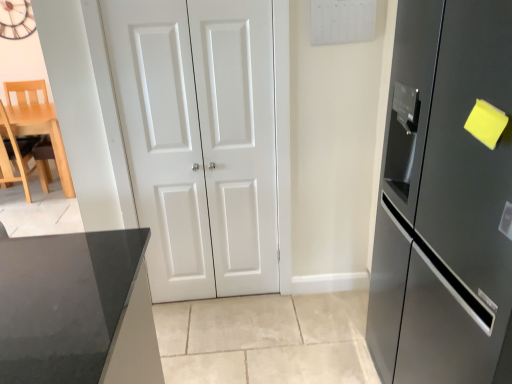
Question: Considering the relative sizes of light wood chair at left and white matte door at center, positioned as the 1th door in left-to-right order, in the image provided, is light wood chair at left wider than white matte door at center, positioned as the 1th door in left-to-right order,?

Choices:
 (A) yes
 (B) no

Answer: (A)

Question: Does light wood chair at left come behind white matte door at center, positioned as the 1th door in left-to-right order?

Choices:
 (A) yes
 (B) no

Answer: (A)

Question: Is light wood chair at left facing away from white matte door at center, placed as the second door when sorted from right to left?

Choices:
 (A) yes
 (B) no

Answer: (B)

Question: Is light wood chair at left positioned before white matte door at center, positioned as the 1th door in left-to-right order?

Choices:
 (A) no
 (B) yes

Answer: (A)

Question: From a real-world perspective, does light wood chair at left sit lower than white matte door at center, placed as the second door when sorted from right to left?

Choices:
 (A) no
 (B) yes

Answer: (B)

Question: From their relative heights in the image, would you say wooden clock at upper left is taller or shorter than light wood chair at left?

Choices:
 (A) short
 (B) tall

Answer: (A)

Question: Is wooden clock at upper left to the left or to the right of light wood chair at left in the image?

Choices:
 (A) left
 (B) right

Answer: (A)

Question: Looking at their shapes, would you say wooden clock at upper left is wider or thinner than light wood chair at left?

Choices:
 (A) wide
 (B) thin

Answer: (B)

Question: Considering the positions of point (11, 8) and point (3, 177), is point (11, 8) closer or farther from the camera than point (3, 177)?

Choices:
 (A) farther
 (B) closer

Answer: (B)

Question: Considering their positions, is white matte door at center, positioned as the first door in right-to-left order, located in front of or behind wooden clock at upper left?

Choices:
 (A) behind
 (B) front

Answer: (B)

Question: In the image, is white matte door at center, positioned as the first door in right-to-left order, on the left side or the right side of wooden clock at upper left?

Choices:
 (A) right
 (B) left

Answer: (A)

Question: From the image's perspective, is white matte door at center, which is the 2th door in left-to-right order, above or below wooden clock at upper left?

Choices:
 (A) below
 (B) above

Answer: (A)

Question: From a real-world perspective, is white matte door at center, positioned as the first door in right-to-left order, positioned above or below wooden clock at upper left?

Choices:
 (A) above
 (B) below

Answer: (B)

Question: From the image's perspective, is light wood chair at left located above or below white matte door at center, which is the 2th door in left-to-right order?

Choices:
 (A) above
 (B) below

Answer: (A)

Question: Considering the positions of light wood chair at left and white matte door at center, which is the 2th door in left-to-right order, in the image, is light wood chair at left bigger or smaller than white matte door at center, which is the 2th door in left-to-right order,?

Choices:
 (A) big
 (B) small

Answer: (A)